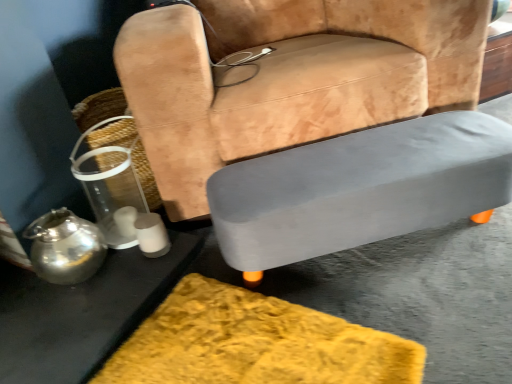
Question: Are clear plastic basket at left and suede-like tan chair at center far apart?

Choices:
 (A) no
 (B) yes

Answer: (A)

Question: Considering the relative positions of clear plastic basket at left and suede-like tan chair at center in the image provided, is clear plastic basket at left in front of suede-like tan chair at center?

Choices:
 (A) yes
 (B) no

Answer: (B)

Question: Could suede-like tan chair at center be considered to be inside clear plastic basket at left?

Choices:
 (A) yes
 (B) no

Answer: (B)

Question: Does clear plastic basket at left appear on the left side of suede-like tan chair at center?

Choices:
 (A) yes
 (B) no

Answer: (A)

Question: From a real-world perspective, is clear plastic basket at left physically below suede-like tan chair at center?

Choices:
 (A) yes
 (B) no

Answer: (A)

Question: From a real-world perspective, is metallic silver table at lower left, the first table from the left, physically located above or below clear plastic basket at left?

Choices:
 (A) below
 (B) above

Answer: (A)

Question: From the image's perspective, relative to clear plastic basket at left, is metallic silver table at lower left, the first table from the left, above or below?

Choices:
 (A) below
 (B) above

Answer: (A)

Question: From their relative heights in the image, would you say metallic silver table at lower left, the second table in the right-to-left sequence, is taller or shorter than clear plastic basket at left?

Choices:
 (A) tall
 (B) short

Answer: (B)

Question: In terms of width, does metallic silver table at lower left, the second table in the right-to-left sequence, look wider or thinner when compared to clear plastic basket at left?

Choices:
 (A) thin
 (B) wide

Answer: (B)

Question: From their relative heights in the image, would you say suede-like tan chair at center is taller or shorter than metallic silver table at lower left, the second table in the right-to-left sequence?

Choices:
 (A) short
 (B) tall

Answer: (B)

Question: In terms of size, does suede-like tan chair at center appear bigger or smaller than metallic silver table at lower left, the first table from the left?

Choices:
 (A) small
 (B) big

Answer: (B)

Question: Considering the positions of point (204, 173) and point (166, 271), is point (204, 173) closer or farther from the camera than point (166, 271)?

Choices:
 (A) closer
 (B) farther

Answer: (B)

Question: Looking at their shapes, would you say suede-like tan chair at center is wider or thinner than metallic silver table at lower left, the second table in the right-to-left sequence?

Choices:
 (A) thin
 (B) wide

Answer: (B)

Question: In the image, is gray matte table at lower right, the 2th table when ordered from left to right, positioned in front of or behind metallic silver table at lower left, the first table from the left?

Choices:
 (A) behind
 (B) front

Answer: (A)

Question: From a real-world perspective, relative to metallic silver table at lower left, the first table from the left, is gray matte table at lower right, the 1th table when ordered from right to left, vertically above or below?

Choices:
 (A) above
 (B) below

Answer: (A)